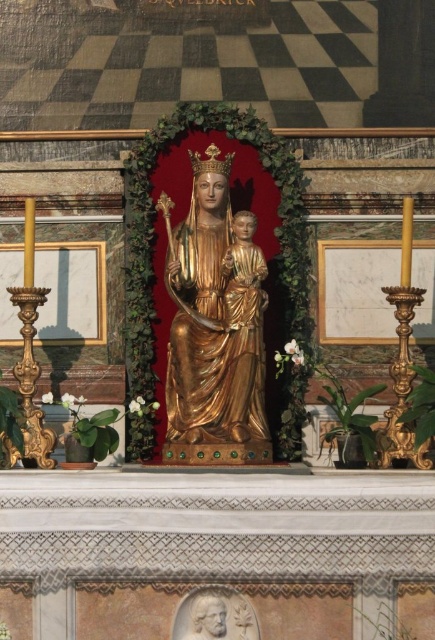
Can you confirm if gold polished statue at center is thinner than white marble bust at lower center?

Incorrect, gold polished statue at center's width is not less than white marble bust at lower center's.

Is gold polished statue at center wider than white marble bust at lower center?

Correct, the width of gold polished statue at center exceeds that of white marble bust at lower center.

Is point (196, 253) positioned after point (244, 604)?

Yes, it is.

Where is `gold polished statue at center`? gold polished statue at center is located at coordinates click(216, 321).